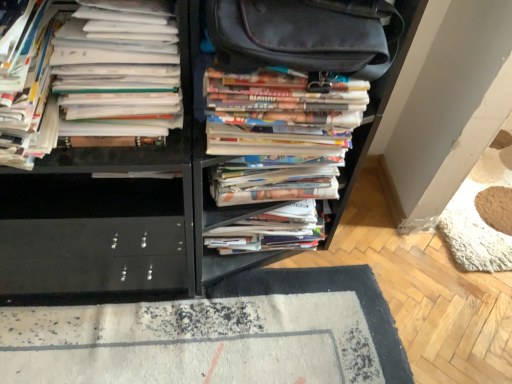
Question: Considering the relative positions of multicolored paper stack at center, placed as the 1th book when sorted from right to left, and white paper stack at left, arranged as the second book when viewed from the left, in the image provided, is multicolored paper stack at center, placed as the 1th book when sorted from right to left, to the left or to the right of white paper stack at left, arranged as the second book when viewed from the left,?

Choices:
 (A) left
 (B) right

Answer: (B)

Question: In terms of size, does multicolored paper stack at center, placed as the 1th book when sorted from right to left, appear bigger or smaller than white paper stack at left, arranged as the second book when viewed from the left?

Choices:
 (A) small
 (B) big

Answer: (A)

Question: Which object is the closest to the white paper stack at center, which appears as the third book when viewed from the left?

Choices:
 (A) white paper stack at left, which is the third book in right-to-left order
 (B) white paper stack at left, which is the first book in left-to-right order
 (C) multicolored paper stack at center, acting as the fourth book starting from the left

Answer: (C)

Question: Which of these objects is positioned closest to the white paper stack at center, which appears as the third book when viewed from the left?

Choices:
 (A) white paper stack at left, which is the third book in right-to-left order
 (B) white paper stack at left, which is the first book in left-to-right order
 (C) multicolored paper stack at center, acting as the fourth book starting from the left

Answer: (C)